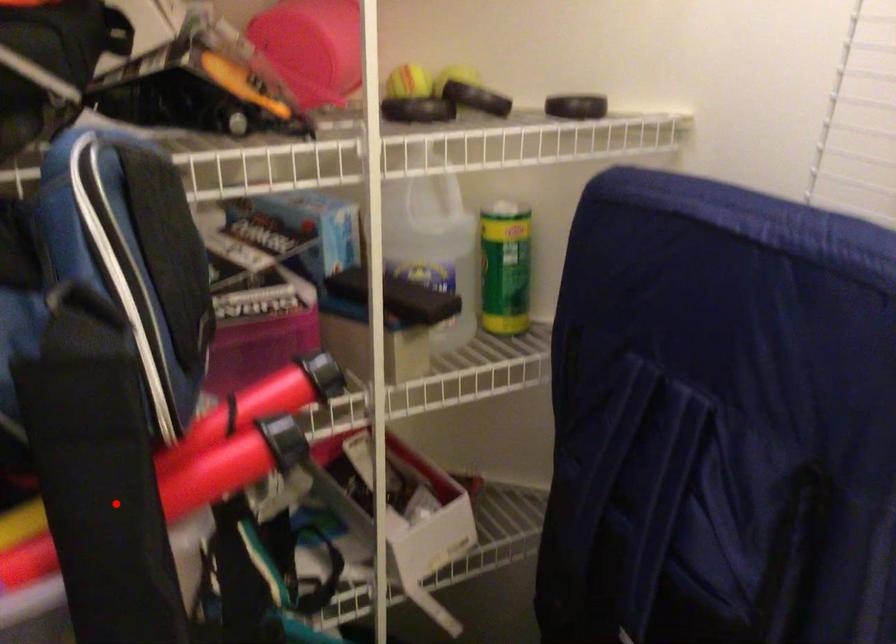
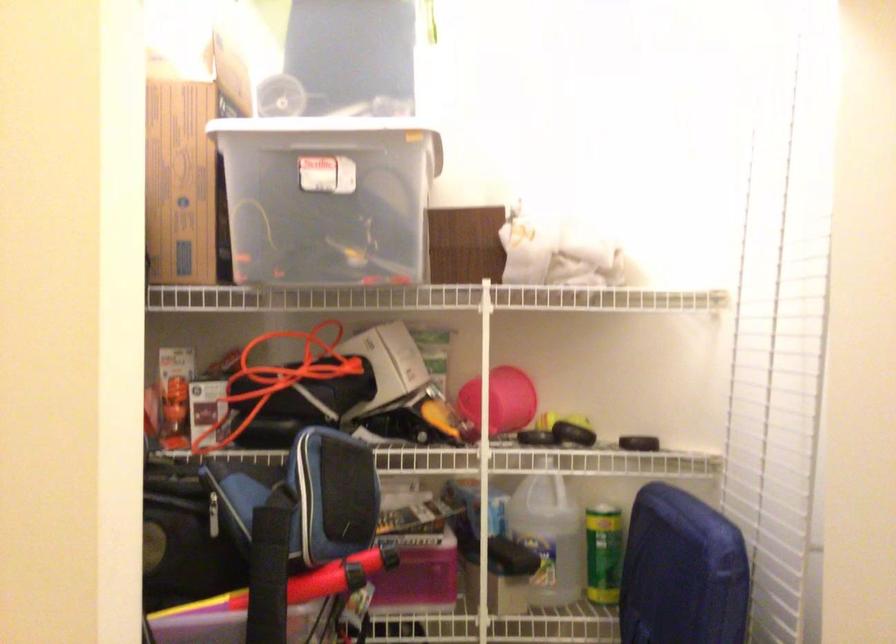
Question: I am providing you with two images of the same scene from different viewpoints. Image1 has a red point marked. In image2, the corresponding 3D location appears at what relative position? Reply with the corresponding letter.

Choices:
 (A) Closer
 (B) Farther

Answer: (B)